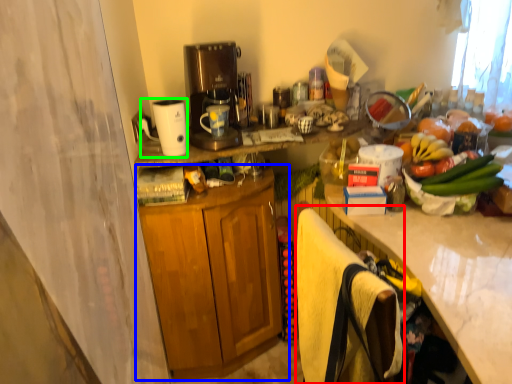
Question: Which is nearer to the beach towel (highlighted by a red box)? cabinetry (highlighted by a blue box) or appliance (highlighted by a green box).

Choices:
 (A) cabinetry
 (B) appliance

Answer: (A)